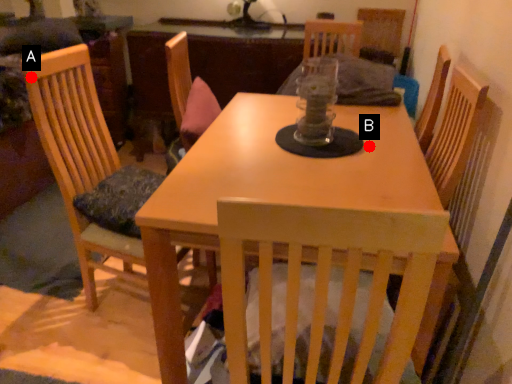
Question: Two points are circled on the image, labeled by A and B beside each circle. Which point appears closest to the camera in this image?

Choices:
 (A) A is closer
 (B) B is closer

Answer: (A)